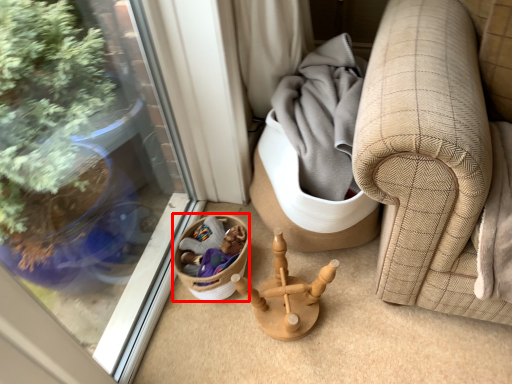
Question: Considering the relative positions of basket (annotated by the red box) and miniature in the image provided, where is basket (annotated by the red box) located with respect to the staircase?

Choices:
 (A) left
 (B) right

Answer: (A)